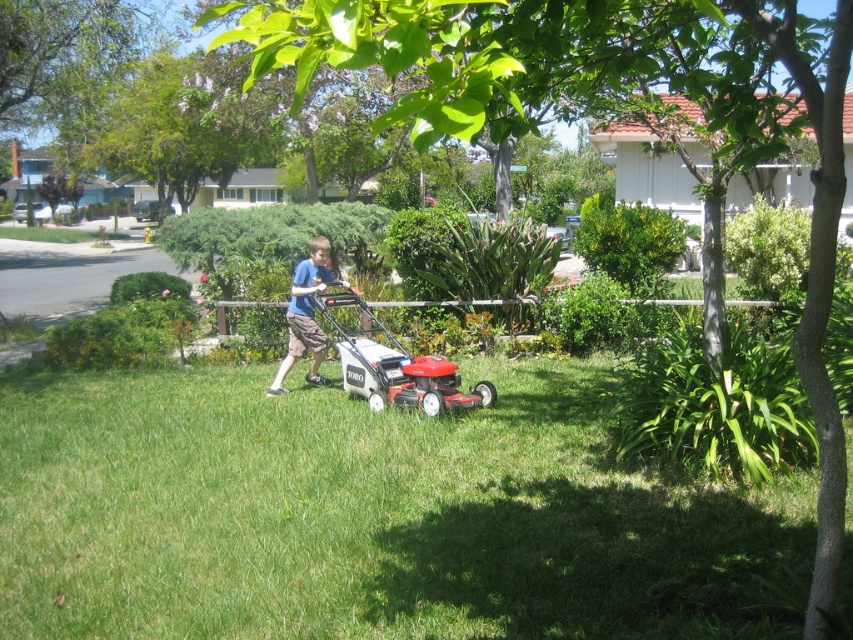
You are a drone operator trying to capture a photo of the boy mowing the lawn. You need to ensure the green grass at center and the blue cotton shirt at center are both in focus. Which object should you adjust the camera focus on first to ensure both are sharp?

The green grass at center is closer to the viewer than the blue cotton shirt at center. To ensure both are in focus, adjust the focus starting with the closer object, which is the green grass at center, as focusing on it first will help the camera capture depth of field that includes the blue cotton shirt at center.

You are a gardener who needs to determine the relative sizes of the green grass at center and the blue cotton shirt at center. Which object is smaller in size?

The green grass at center is smaller in size compared to the blue cotton shirt at center according to the description.